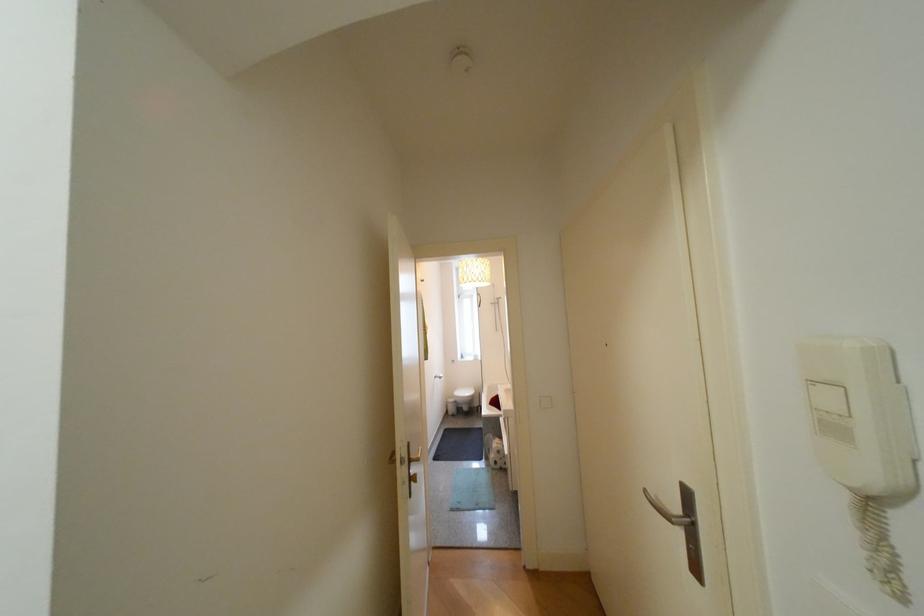
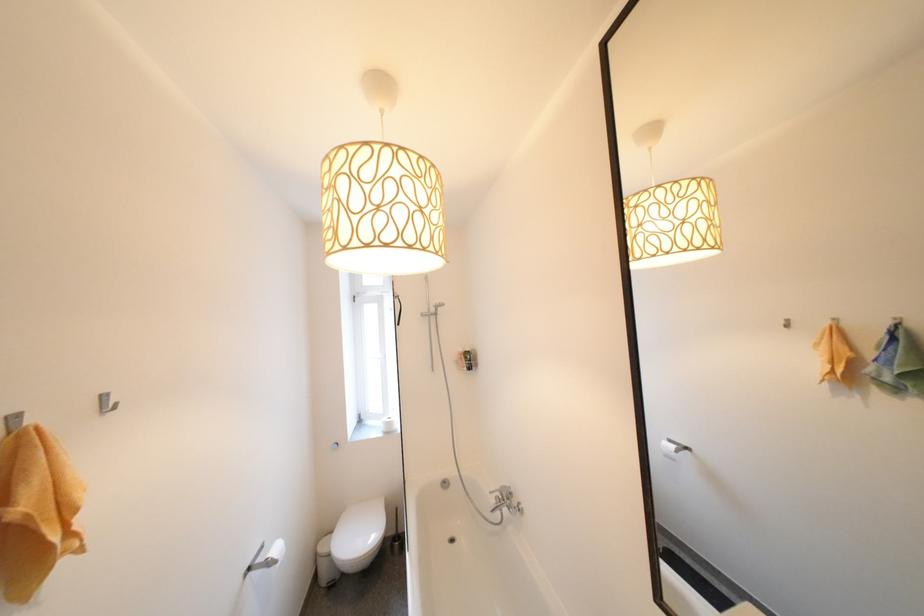
Where in the second image is the point corresponding to [503,302] from the first image?

(434, 312)